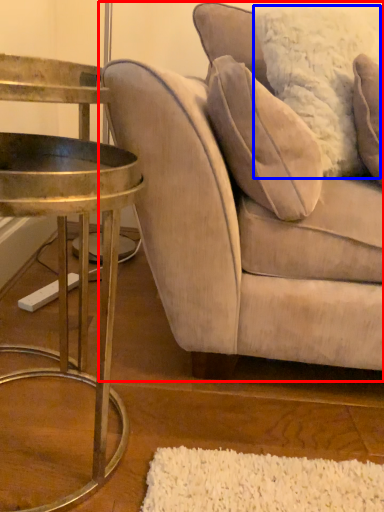
Question: Which point is further to the camera, studio couch (highlighted by a red box) or pillow (highlighted by a blue box)?

Choices:
 (A) studio couch
 (B) pillow

Answer: (B)